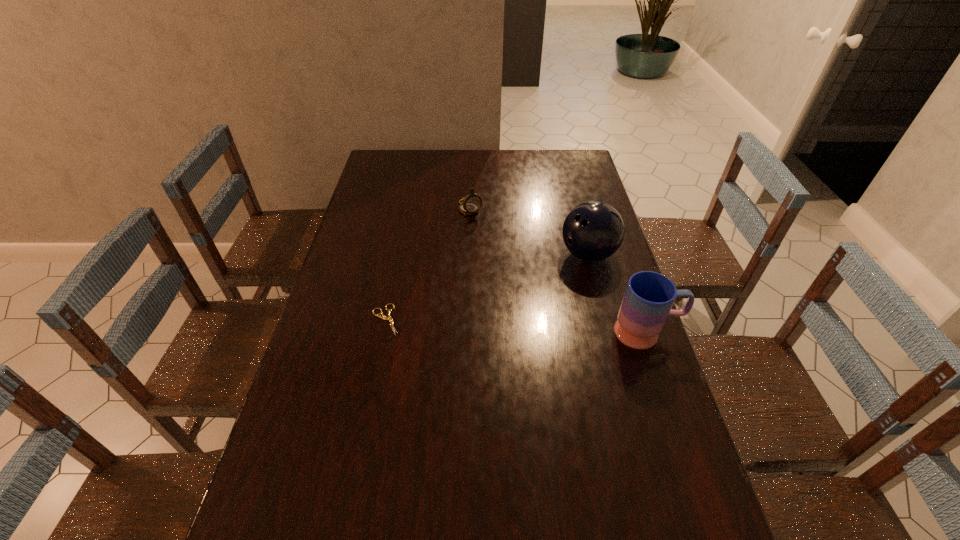
The height and width of the screenshot is (540, 960). Find the location of `free space located 0.090m on the face of the second object from left to right`. free space located 0.090m on the face of the second object from left to right is located at coordinates (484, 232).

The width and height of the screenshot is (960, 540). In order to click on free point located on the face of the second object from left to right in this screenshot , I will do `click(483, 230)`.

Find the location of a particular element. vacant space located on the face of the second object from left to right is located at coordinates (492, 244).

Find the location of `object that is positioned at the left edge`. object that is positioned at the left edge is located at coordinates (389, 318).

This screenshot has width=960, height=540. What are the coordinates of `mug situated at the right edge` in the screenshot? It's located at (649, 296).

Locate an element on the screen. The height and width of the screenshot is (540, 960). bowling ball at the right edge is located at coordinates (593, 231).

Where is `free spot at the far edge of the desktop`? The width and height of the screenshot is (960, 540). free spot at the far edge of the desktop is located at coordinates (422, 173).

Image resolution: width=960 pixels, height=540 pixels. Find the location of `free space at the left edge of the desktop`. free space at the left edge of the desktop is located at coordinates click(346, 357).

In the image, there is a desktop. Where is `vacant space at the right edge`? vacant space at the right edge is located at coordinates 676,468.

Find the location of a particular element. This screenshot has height=540, width=960. free space between the second farthest object and the mug is located at coordinates (617, 293).